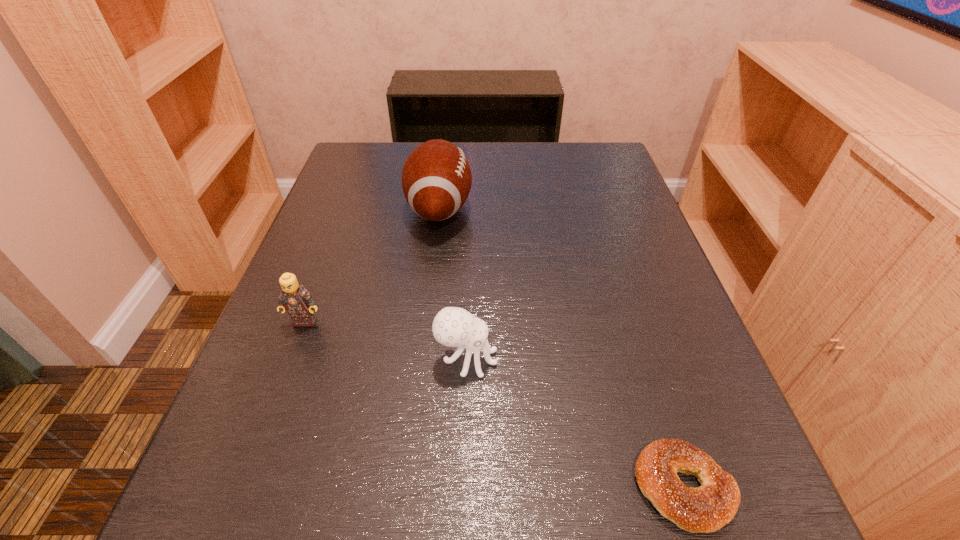
The width and height of the screenshot is (960, 540). I want to click on vacant area between the third farthest object and the nearest object, so click(x=575, y=423).

Locate an element on the screen. vacant area between the farthest object and the octopus is located at coordinates (453, 284).

You are a GUI agent. You are given a task and a screenshot of the screen. Output one action in this format:
    pyautogui.click(x=<x>, y=<y>)
    Task: Click on the object that stands as the third closest to the shortest object
    The width and height of the screenshot is (960, 540).
    Given the screenshot: What is the action you would take?
    click(x=294, y=298)

Locate an element on the screen. This screenshot has height=540, width=960. object that can be found as the third closest to the octopus is located at coordinates (436, 178).

Locate an element on the screen. free space in the image that satisfies the following two spatial constraints: 1. on the laces of the tallest object; 2. in front of the Lego is located at coordinates (426, 321).

Find the location of a particular element. The height and width of the screenshot is (540, 960). free location that satisfies the following two spatial constraints: 1. on the front-facing side of the third farthest object; 2. on the right side of the nearest object is located at coordinates (463, 487).

Image resolution: width=960 pixels, height=540 pixels. I want to click on vacant region that satisfies the following two spatial constraints: 1. in front of the bagel; 2. on the left side of the leftmost object, so click(x=243, y=487).

Where is `free space in the image that satisfies the following two spatial constraints: 1. on the laces of the rightmost object; 2. on the left side of the farthest object`? Image resolution: width=960 pixels, height=540 pixels. free space in the image that satisfies the following two spatial constraints: 1. on the laces of the rightmost object; 2. on the left side of the farthest object is located at coordinates (407, 487).

The height and width of the screenshot is (540, 960). Identify the location of free location that satisfies the following two spatial constraints: 1. on the laces of the football; 2. on the right side of the shortest object. (407, 487).